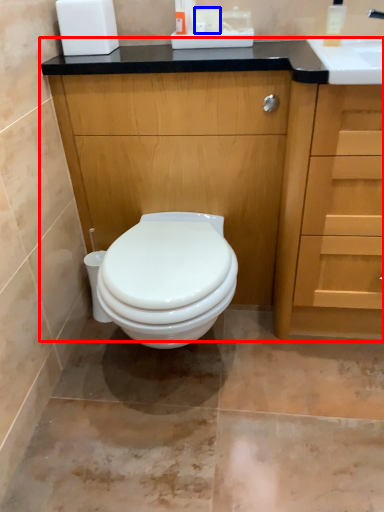
Question: Which object is closer to the camera taking this photo, bathroom cabinet (highlighted by a red box) or toilet paper (highlighted by a blue box)?

Choices:
 (A) bathroom cabinet
 (B) toilet paper

Answer: (A)